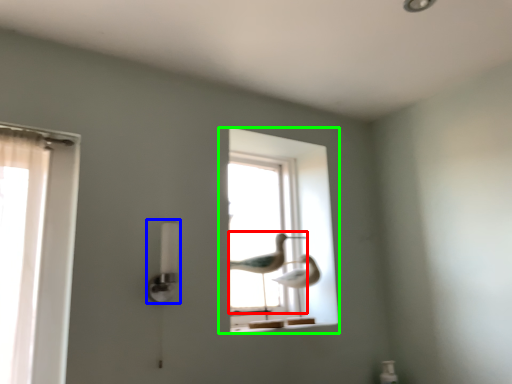
Question: Considering the real-world distances, which object is farthest from bird (highlighted by a red box)? lamp (highlighted by a blue box) or window (highlighted by a green box)?

Choices:
 (A) lamp
 (B) window

Answer: (A)